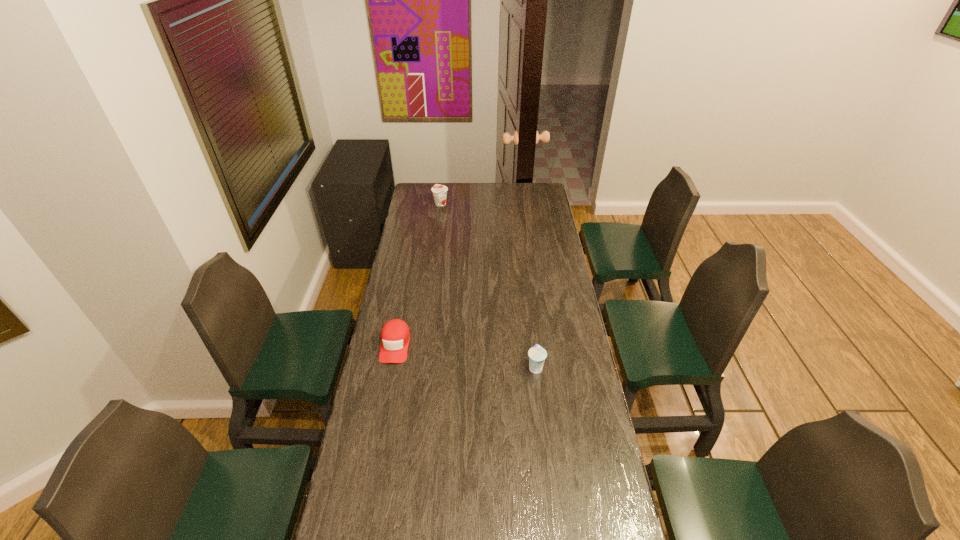
In order to click on free space that satisfies the following two spatial constraints: 1. on the front-facing side of the rightmost object; 2. on the left side of the baseball cap in this screenshot , I will do `click(391, 367)`.